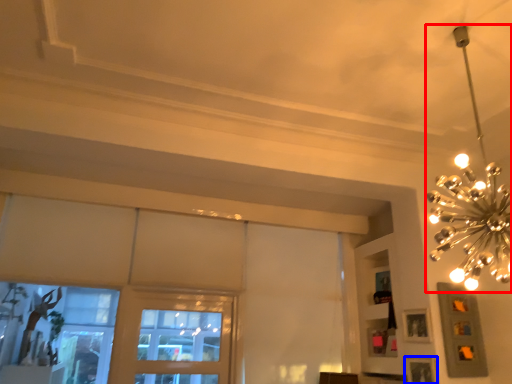
Question: Which object appears farthest to the camera in this image, lamp (highlighted by a red box) or picture frame (highlighted by a blue box)?

Choices:
 (A) lamp
 (B) picture frame

Answer: (B)